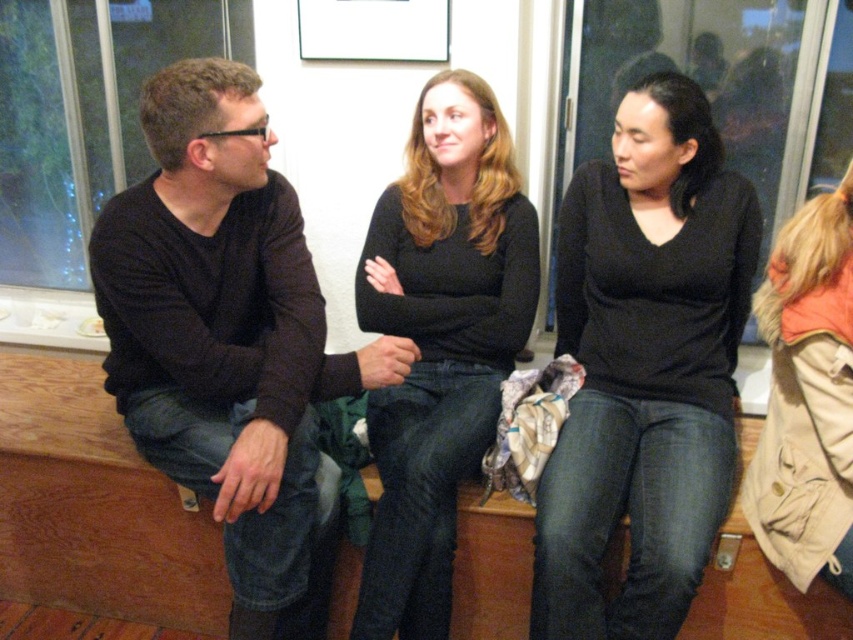
Who is lower down, black matte shirt at center or matte black shirt at center?

black matte shirt at center is below.

At what (x,y) coordinates should I click in order to perform the action: click on black matte shirt at center. Please return your answer as a coordinate pair (x, y). The image size is (853, 640). Looking at the image, I should click on (645, 368).

Between black matte sweater at left and matte black shirt at center, which one is positioned higher?

Positioned higher is matte black shirt at center.

Between black matte sweater at left and matte black shirt at center, which one is positioned lower?

black matte sweater at left is below.

What are the coordinates of `black matte sweater at left` in the screenshot? It's located at (229, 339).

At what (x,y) coordinates should I click in order to perform the action: click on black matte sweater at left. Please return your answer as a coordinate pair (x, y). The image size is (853, 640). Looking at the image, I should click on (229, 339).

Which is in front, point (320, 349) or point (567, 522)?

Point (567, 522) is in front.

Which is below, black matte sweater at left or black matte shirt at center?

black matte sweater at left is lower down.

Locate an element on the screen. This screenshot has width=853, height=640. black matte sweater at left is located at coordinates (229, 339).